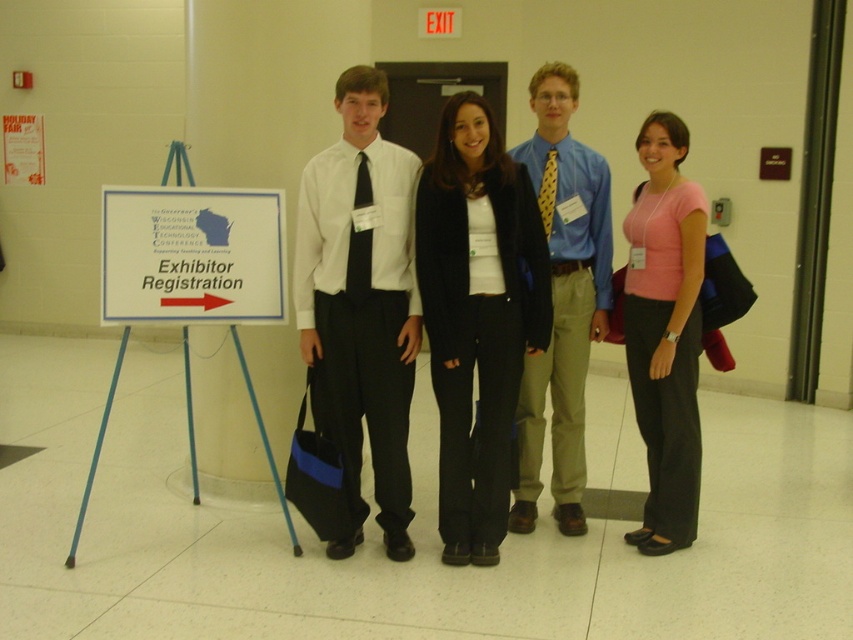
You are standing at the Exhibitor Registration sign and want to know which of the two points, point (469, 548) or point (561, 168), is closer to the sign. Which point is nearer?

Point (469, 548) is in front of point (561, 168), so it is closer to the Exhibitor Registration sign.

You are standing at the Exhibitor Registration sign and need to hand a document to the person wearing the white matte shirt at center. Considering the social distancing guidelines of 3 meters, can you safely approach them without violating the guidelines?

The distance between you and the white matte shirt at center is 3.55 meters, which exceeds the 3 meter requirement, so you can safely approach them without violating social distancing guidelines.